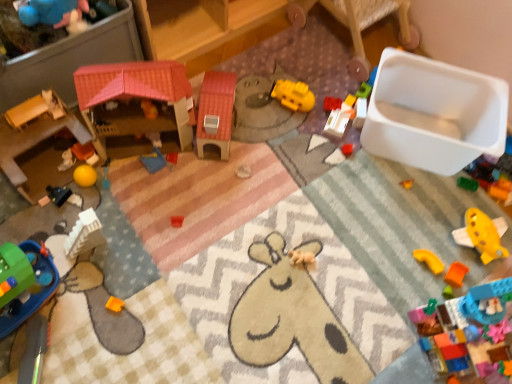
Locate an element on the screen. The width and height of the screenshot is (512, 384). free space to the back side of bright red plastic blocks at center, which ranks as the seventh toy in right-to-left order is located at coordinates pyautogui.click(x=325, y=76).